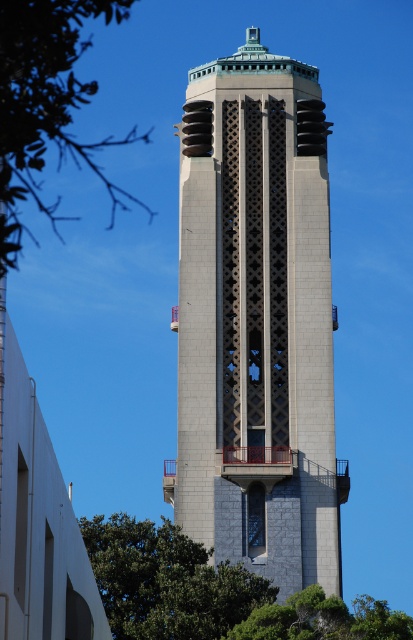
You are standing in front of the tower and want to take a photo that includes both the green leafy tree at upper left and the green leafy tree at lower right. Which tree should you position closer to the left side of your camera frame?

The green leafy tree at upper left should be positioned closer to the left side of your camera frame because it is already to the left of the green leafy tree at lower right.

You are standing in a park and see the gray stone bell tower at center and the green leafy tree at upper left. Which object is taller?

The gray stone bell tower at center is much taller than the green leafy tree at upper left.